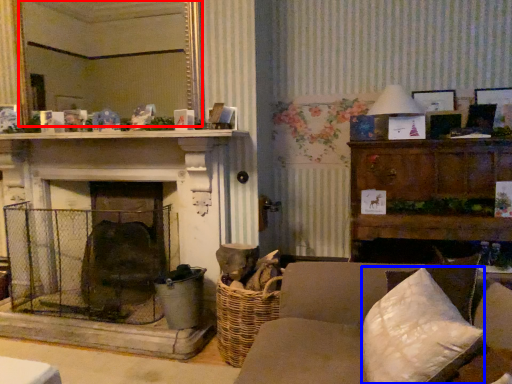
Question: Which object appears closest to the camera in this image, mirror (highlighted by a red box) or pillow (highlighted by a blue box)?

Choices:
 (A) mirror
 (B) pillow

Answer: (B)